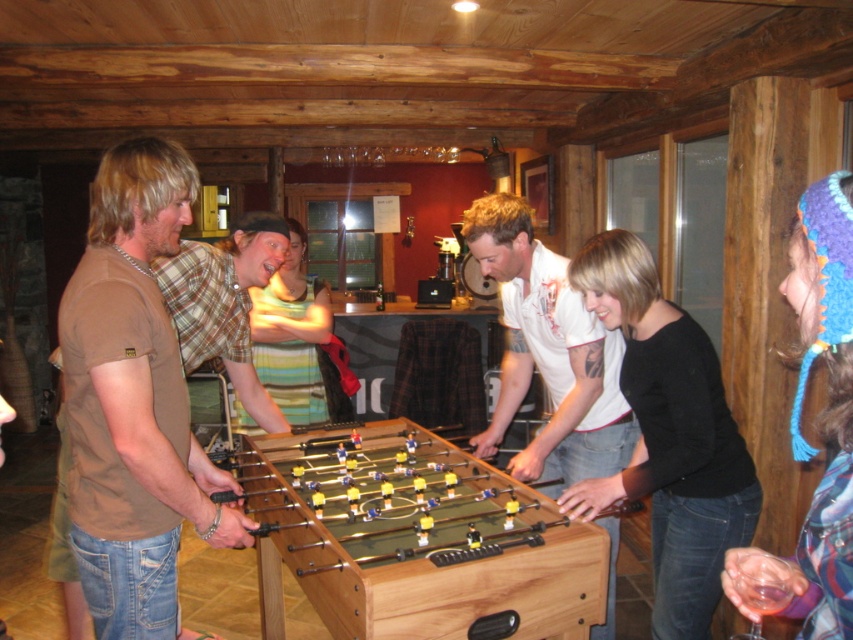
Question: Can you confirm if wooden foosball table at center is thinner than brown cotton t-shirt at left?

Choices:
 (A) yes
 (B) no

Answer: (B)

Question: Which of these objects is positioned closest to the brown cotton t-shirt at left?

Choices:
 (A) blue knitted hat at upper right
 (B) black matte shirt at center

Answer: (B)

Question: Which of the following is the farthest from the observer?

Choices:
 (A) (813, 624)
 (B) (624, 404)
 (C) (154, 180)
 (D) (354, 620)

Answer: (B)

Question: Does white matte shirt at center have a lesser width compared to plaid shirt at center?

Choices:
 (A) no
 (B) yes

Answer: (A)

Question: Based on their relative distances, which object is farther from the brown cotton t-shirt at left?

Choices:
 (A) wooden foosball table at center
 (B) blue knitted hat at upper right

Answer: (B)

Question: Is wooden foosball table at center positioned at the back of plaid shirt at center?

Choices:
 (A) yes
 (B) no

Answer: (B)